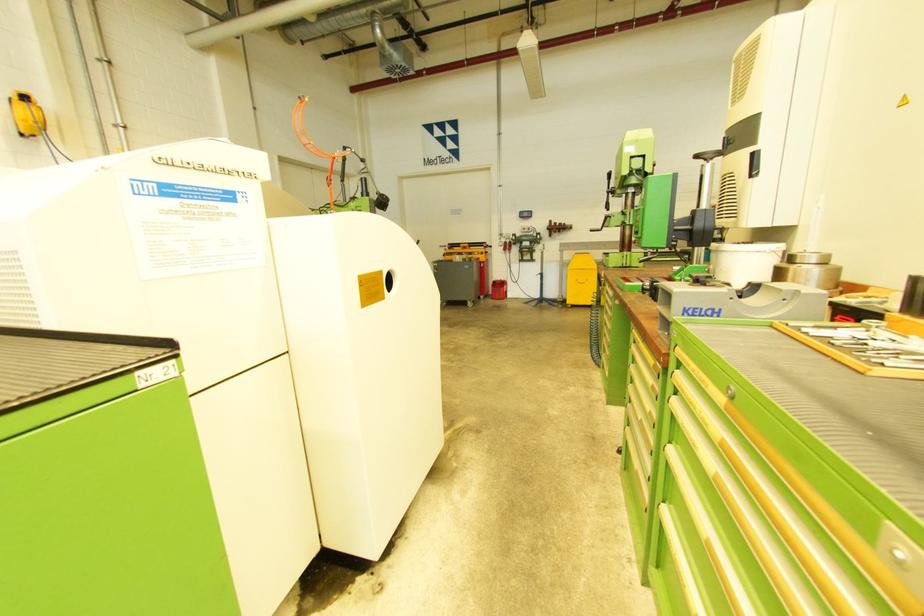
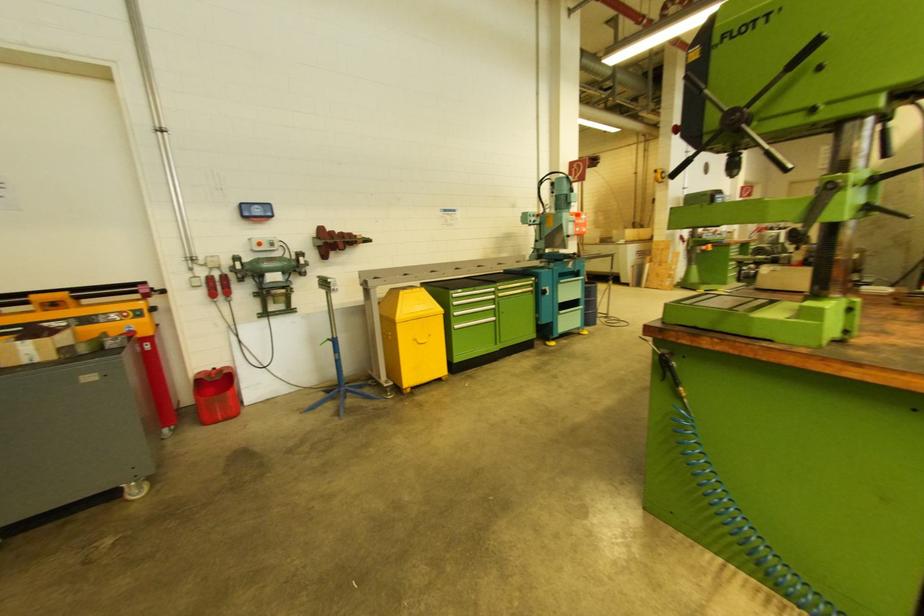
Find the pixel in the second image that matches (507,245) in the first image.

(212, 281)